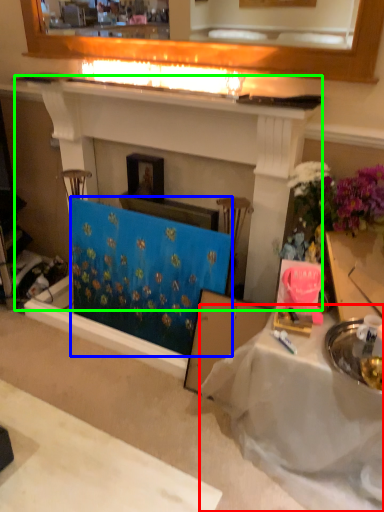
Question: Considering the real-world distances, which object is farthest from table (highlighted by a red box)? curtain (highlighted by a blue box) or fireplace (highlighted by a green box)?

Choices:
 (A) curtain
 (B) fireplace

Answer: (B)